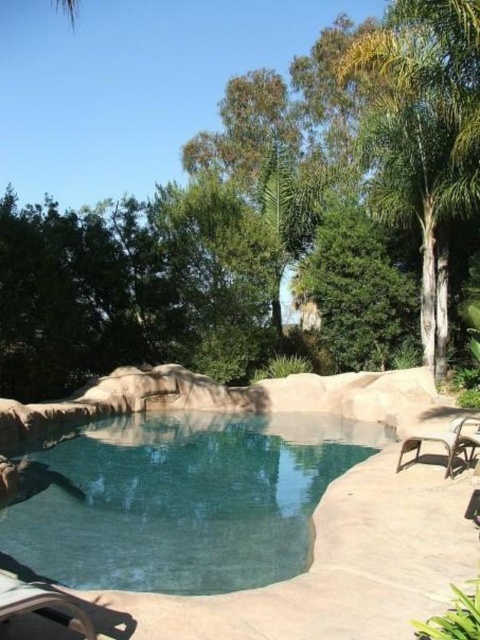
Is point (195, 458) positioned in front of point (445, 449)?

No.

Who is taller, clear blue water at center or brown woven chair at lower right?

With more height is brown woven chair at lower right.

Between point (144, 497) and point (464, 454), which one is positioned in front?

Positioned in front is point (464, 454).

What are the coordinates of `clear blue water at center` in the screenshot? It's located at (183, 500).

Can you confirm if metallic silver chair at lower left is smaller than brown woven chair at lower right?

Yes.

Which is behind, point (13, 612) or point (471, 445)?

The point (471, 445) is more distant.

Who is more forward, (38,582) or (456,442)?

Point (38,582)

Locate an element on the screen. metallic silver chair at lower left is located at coordinates (41, 604).

Between point (51, 566) and point (3, 579), which one is positioned behind?

Positioned behind is point (51, 566).

Identify the location of clear blue water at center. This screenshot has height=640, width=480. (183, 500).